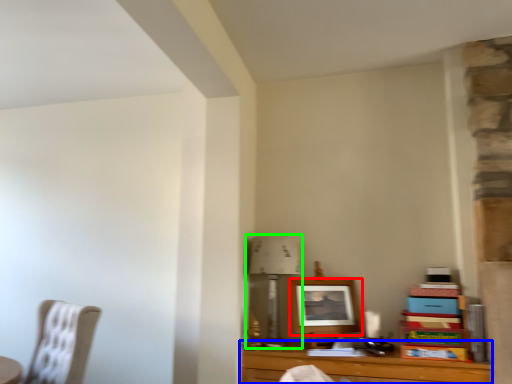
Question: Estimate the real-world distances between objects in this image. Which object is closer to picture frame (highlighted by a red box), table (highlighted by a blue box) or table lamp (highlighted by a green box)?

Choices:
 (A) table
 (B) table lamp

Answer: (B)